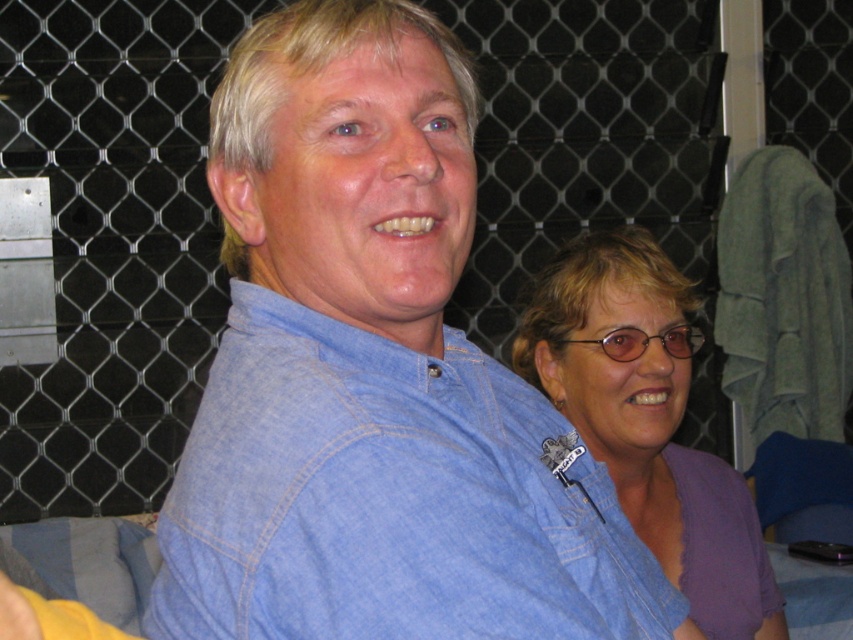
You are standing in front of the image and want to touch the denim shirt at upper center and the purple cotton shirt at right. Which one can you reach without moving your hand further away from your body?

The denim shirt at upper center is closer to the viewer than the purple cotton shirt at right, so you can reach it without moving your hand further away from your body.

You are at a social event and want to take a photo of both the man in the foreground and the woman behind him. The camera you are using has a limited depth of field and can only focus on one point at a time. If you focus on point (314, 589), will the woman at point (775, 611) also be in focus?

Point (314, 589) is in front of point (775, 611). Since the camera can only focus on one point, focusing on the closer point may not ensure the farther point is in focus. However, depth of field depends on factors like aperture and distance. Without specific parameters, it is uncertain, but generally, focusing on the closer subject might leave the background slightly out of focus.

You are standing in front of the image and want to locate the denim shirt at upper center. According to the coordinates provided, where should you look relative to the center of the image?

The denim shirt at upper center is located at coordinates point 0.780 on the x axis and 0.457 on the y axis. Since the x coordinate is greater than 0.5, it is to the right of center. The y coordinate is also greater than 0.5, so it is above the center of the image.